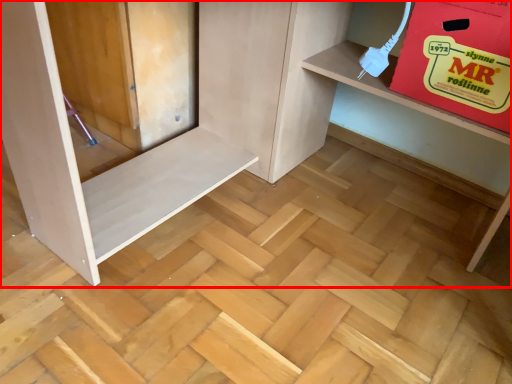
Question: In this image, where is furniture (annotated by the red box) located relative to cardboard box?

Choices:
 (A) left
 (B) right

Answer: (A)